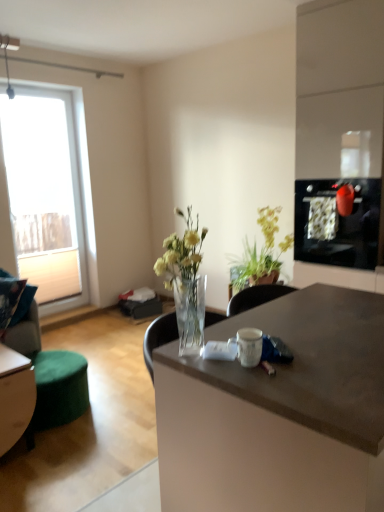
Identify the location of unoccupied space behind white matte coffee cup at center. (255, 328).